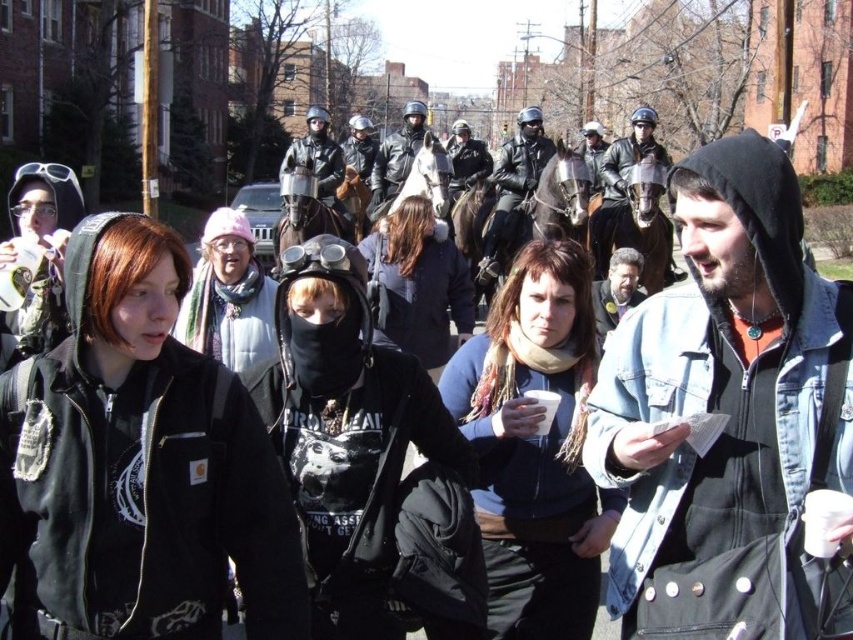
Question: Which point is farther from the camera taking this photo?

Choices:
 (A) (601, 180)
 (B) (616, 296)
 (C) (509, 195)

Answer: (A)

Question: Which point is closer to the camera taking this photo?

Choices:
 (A) (479, 260)
 (B) (596, 262)
 (C) (758, 480)

Answer: (C)

Question: Does shiny black leather jacket at center come in front of shiny black helmet at center?

Choices:
 (A) yes
 (B) no

Answer: (B)

Question: Is shiny black leather jacket at center to the left of dark brown leather jacket at center from the viewer's perspective?

Choices:
 (A) yes
 (B) no

Answer: (A)

Question: Observing the image, what is the correct spatial positioning of denim jacket at center in reference to dark brown leather jacket at center?

Choices:
 (A) left
 (B) right

Answer: (A)

Question: Which of the following is the farthest from the observer?

Choices:
 (A) shiny black helmet at center
 (B) denim jacket at center

Answer: (A)